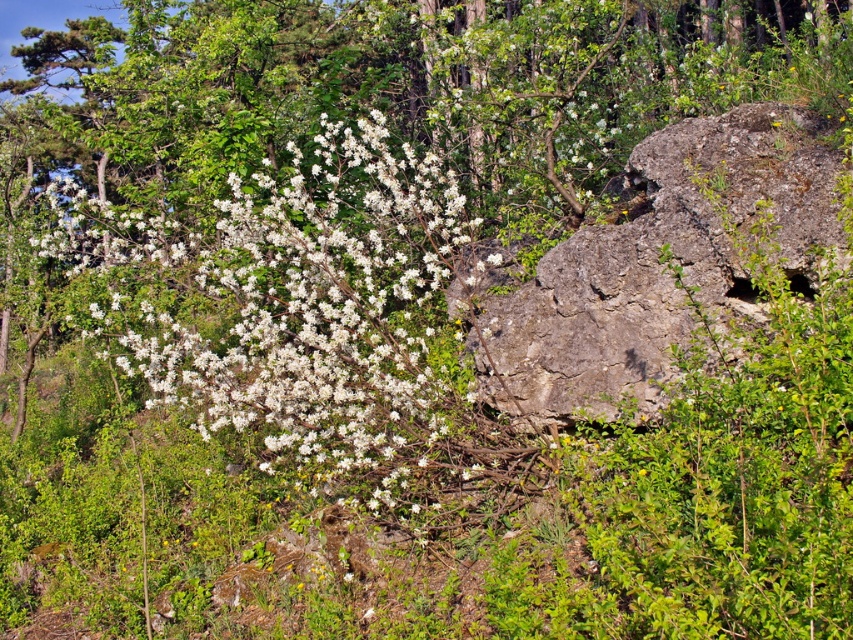
Question: Does white matte flowers at center appear over gray rough rock at right?

Choices:
 (A) no
 (B) yes

Answer: (B)

Question: Does white matte flowers at center have a larger size compared to gray rough rock at right?

Choices:
 (A) yes
 (B) no

Answer: (B)

Question: Which point is farther to the camera?

Choices:
 (A) (721, 195)
 (B) (265, 163)

Answer: (B)

Question: Does white matte flowers at center appear on the left side of gray rough rock at right?

Choices:
 (A) yes
 (B) no

Answer: (A)

Question: Which point is closer to the camera taking this photo?

Choices:
 (A) (816, 177)
 (B) (370, 388)

Answer: (A)